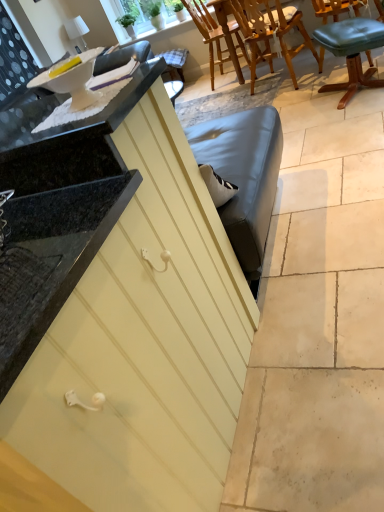
Question: Is matte yellow cabinet at center positioned with its back to white glossy countertop at upper left?

Choices:
 (A) yes
 (B) no

Answer: (B)

Question: Considering the relative sizes of matte yellow cabinet at center and white glossy countertop at upper left in the image provided, is matte yellow cabinet at center thinner than white glossy countertop at upper left?

Choices:
 (A) yes
 (B) no

Answer: (B)

Question: Is matte yellow cabinet at center far away from white glossy countertop at upper left?

Choices:
 (A) no
 (B) yes

Answer: (A)

Question: Does matte yellow cabinet at center appear on the left side of white glossy countertop at upper left?

Choices:
 (A) yes
 (B) no

Answer: (A)

Question: Does matte yellow cabinet at center have a larger size compared to white glossy countertop at upper left?

Choices:
 (A) no
 (B) yes

Answer: (B)

Question: From the image's perspective, is matte yellow cabinet at center over white glossy countertop at upper left?

Choices:
 (A) no
 (B) yes

Answer: (A)

Question: Considering the relative sizes of wooden chair at upper center, which appears as the second chair when viewed from the front, and white glossy countertop at upper left in the image provided, is wooden chair at upper center, which appears as the second chair when viewed from the front, shorter than white glossy countertop at upper left?

Choices:
 (A) yes
 (B) no

Answer: (B)

Question: Is wooden chair at upper center, marked as the second chair in a back-to-front arrangement, facing away from white glossy countertop at upper left?

Choices:
 (A) no
 (B) yes

Answer: (B)

Question: Does wooden chair at upper center, which appears as the second chair when viewed from the front, lie behind white glossy countertop at upper left?

Choices:
 (A) no
 (B) yes

Answer: (B)

Question: Does wooden chair at upper center, marked as the second chair in a back-to-front arrangement, have a greater height compared to white glossy countertop at upper left?

Choices:
 (A) no
 (B) yes

Answer: (B)

Question: From the image's perspective, is wooden chair at upper center, marked as the second chair in a back-to-front arrangement, on white glossy countertop at upper left?

Choices:
 (A) yes
 (B) no

Answer: (A)

Question: Can you confirm if wooden chair at upper center, marked as the second chair in a back-to-front arrangement, is positioned to the right of white glossy countertop at upper left?

Choices:
 (A) no
 (B) yes

Answer: (B)

Question: Is wooden chair at upper center, arranged as the first chair when viewed from the back, beside matte yellow cabinet at center?

Choices:
 (A) yes
 (B) no

Answer: (B)